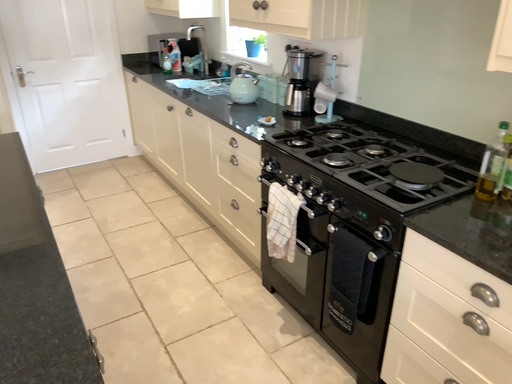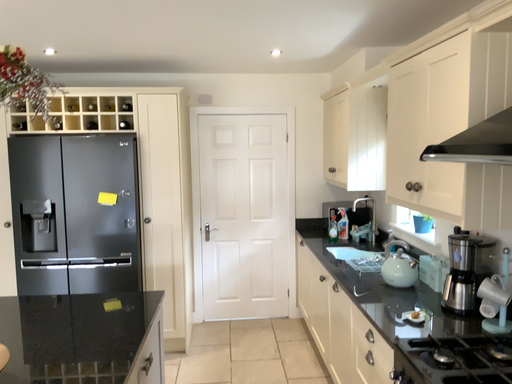
Question: Which way did the camera rotate in the video?

Choices:
 (A) rotated left
 (B) rotated right

Answer: (A)